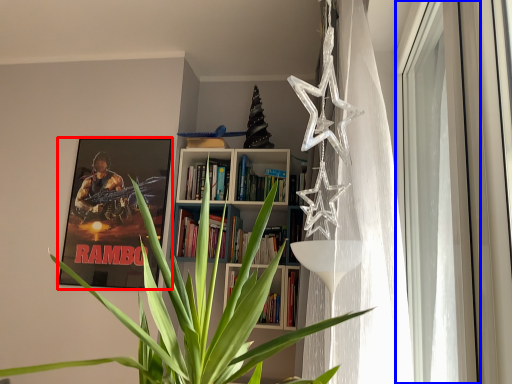
Question: Which point is further to the camera, picture frame (highlighted by a red box) or window (highlighted by a blue box)?

Choices:
 (A) picture frame
 (B) window

Answer: (A)